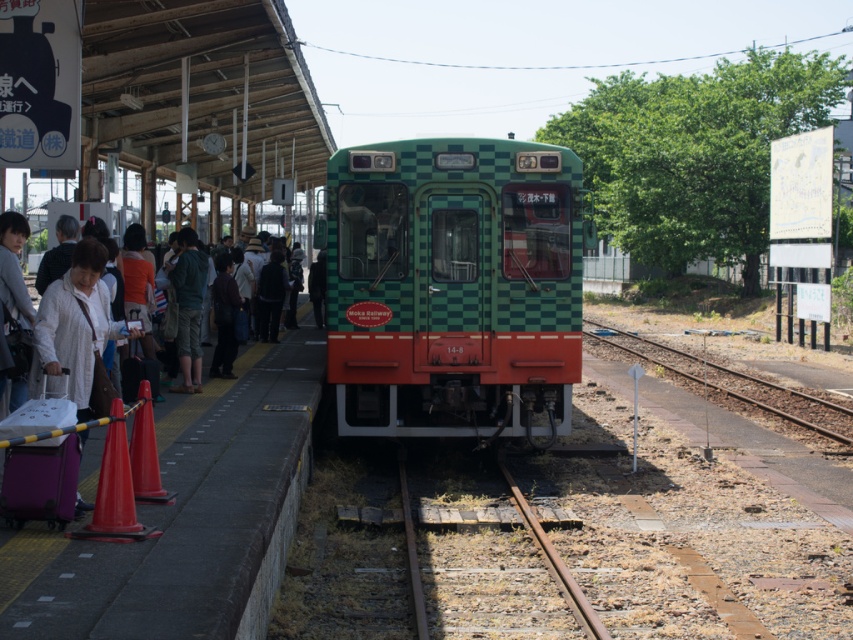
Locate an element on the screen. rusty metal train track at center is located at coordinates (553, 561).

The height and width of the screenshot is (640, 853). I want to click on rusty metal train track at center, so click(x=553, y=561).

Between green checkered train at center and rusty metal train track at center, which one is positioned lower?

Positioned lower is rusty metal train track at center.

Image resolution: width=853 pixels, height=640 pixels. Find the location of `green checkered train at center`. green checkered train at center is located at coordinates (454, 285).

Is point (579, 369) positioned before point (399, 461)?

Yes, it is in front of point (399, 461).

At what (x,y) coordinates should I click in order to perform the action: click on green checkered train at center. Please return your answer as a coordinate pair (x, y). Looking at the image, I should click on (454, 285).

Is green checkered train at center to the right of brown gravel track at lower right from the viewer's perspective?

Incorrect, green checkered train at center is not on the right side of brown gravel track at lower right.

The width and height of the screenshot is (853, 640). What do you see at coordinates (454, 285) in the screenshot?
I see `green checkered train at center` at bounding box center [454, 285].

Where is `green checkered train at center`? Image resolution: width=853 pixels, height=640 pixels. green checkered train at center is located at coordinates (454, 285).